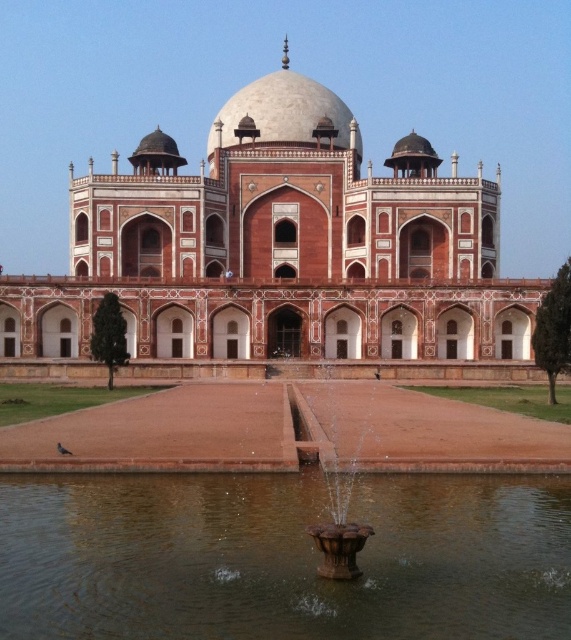
You are standing in front of the grand monument and notice the brown reflective water at center and the bronze metallic fountain at center. Which object is closer to you?

The brown reflective water at center is closer to you since it is in front of the bronze metallic fountain at center.